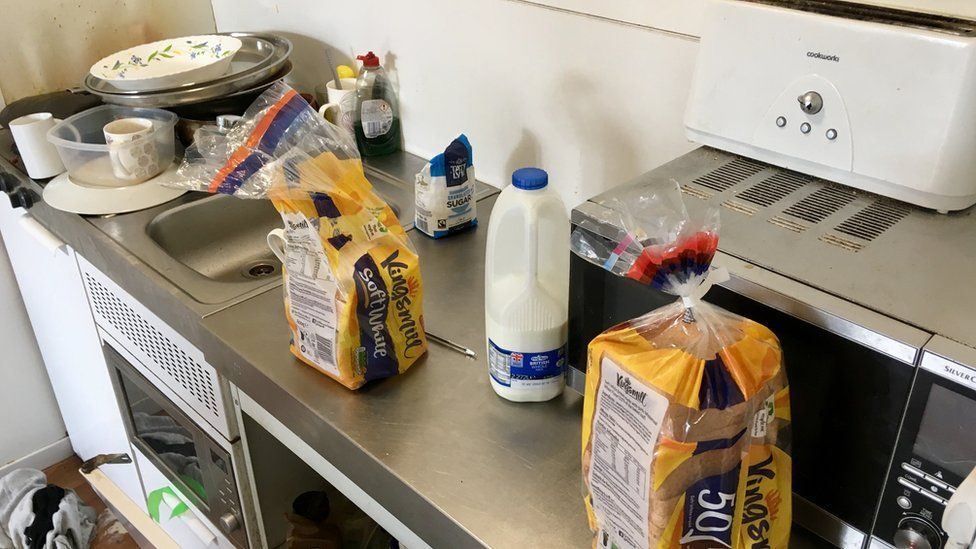
Where is `countertop`? countertop is located at coordinates (422, 440), (399, 405), (260, 315), (433, 273), (512, 448).